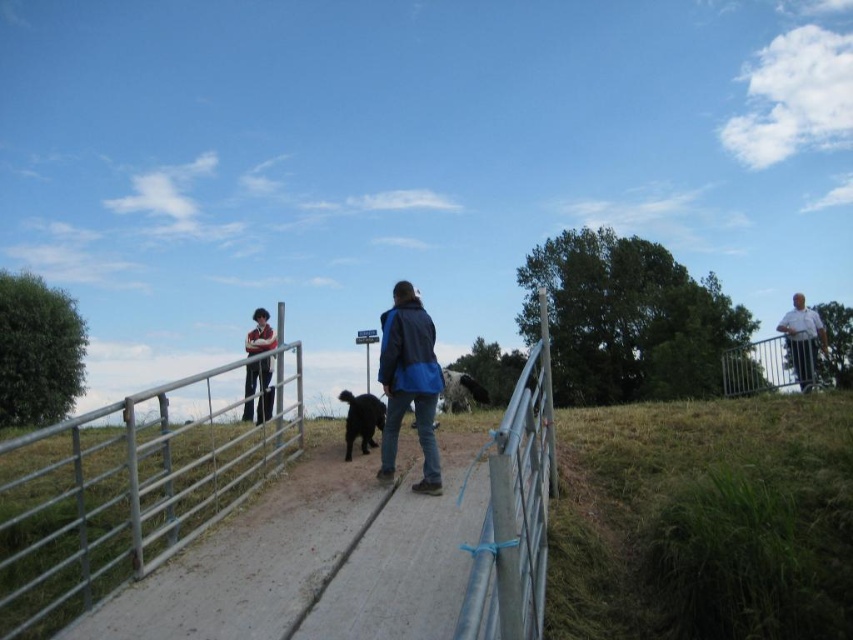
Question: Is smooth concrete path at center wider than silver metallic fence at right?

Choices:
 (A) yes
 (B) no

Answer: (B)

Question: Which point is closer to the camera taking this photo?

Choices:
 (A) (779, 358)
 (B) (809, 332)

Answer: (B)

Question: Among these points, which one is nearest to the camera?

Choices:
 (A) (419, 339)
 (B) (361, 600)
 (C) (154, 429)
 (D) (270, 378)

Answer: (B)

Question: Which of the following is the closest to the observer?

Choices:
 (A) (253, 388)
 (B) (438, 467)
 (C) (808, 388)
 (D) (451, 515)

Answer: (D)

Question: Where is blue fabric jacket at center located in relation to black fur dog at center in the image?

Choices:
 (A) left
 (B) right

Answer: (B)

Question: Can you confirm if silver metallic fence at right is positioned above black fur dog at center?

Choices:
 (A) yes
 (B) no

Answer: (A)